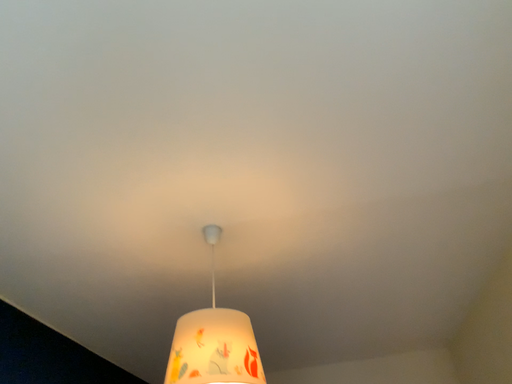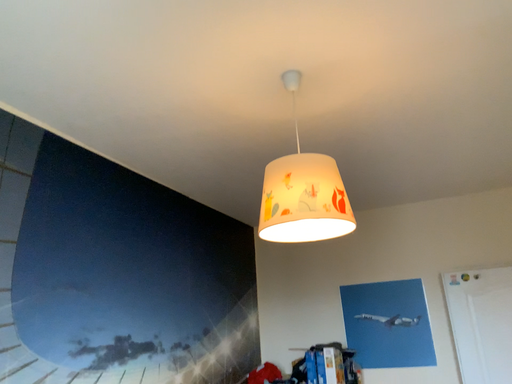
Question: How did the camera likely rotate when shooting the video?

Choices:
 (A) rotated left
 (B) rotated right

Answer: (A)